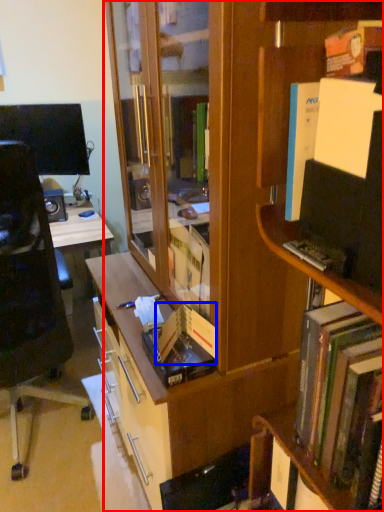
Question: Which point is further to the camera, bookcase (highlighted by a red box) or paperback book (highlighted by a blue box)?

Choices:
 (A) bookcase
 (B) paperback book

Answer: (B)